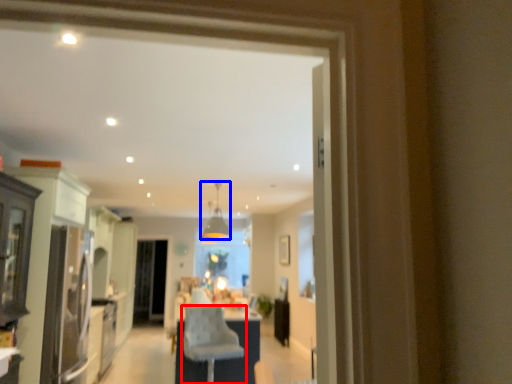
Question: Among these objects, which one is nearest to the camera, chair (highlighted by a red box) or light fixture (highlighted by a blue box)?

Choices:
 (A) chair
 (B) light fixture

Answer: (A)